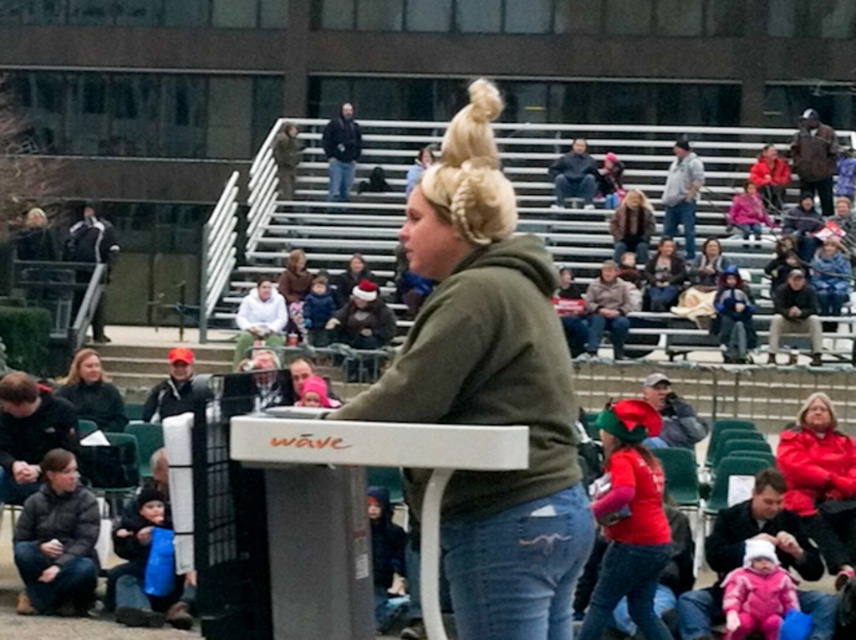
Question: Is dark brown leather jacket at right above blue denim jeans at upper center?

Choices:
 (A) no
 (B) yes

Answer: (A)

Question: Considering the real-world distances, which object is farthest from the jeans at lower center?

Choices:
 (A) white fleece jacket at center
 (B) pink fleece onesie at lower right
 (C) brown leather jacket at upper right

Answer: (C)

Question: Is dark green hoodie at lower left thinner than dark blue jacket at upper left?

Choices:
 (A) yes
 (B) no

Answer: (A)

Question: Does red fleece jacket at upper right have a larger size compared to dark blue jacket at upper left?

Choices:
 (A) yes
 (B) no

Answer: (A)

Question: Among these objects, which one is farthest from the camera?

Choices:
 (A) matte black jacket at center
 (B) matte red jacket at center
 (C) white fleece jacket at center
 (D) green matte hoodie at center

Answer: (C)

Question: Estimate the real-world distances between objects in this image. Which object is farther from the jeans at lower right?

Choices:
 (A) camouflage fabric jacket at upper center
 (B) dark brown leather jacket at right
 (C) dark gray hoodie at upper center
 (D) dark green hoodie at lower left

Answer: (A)